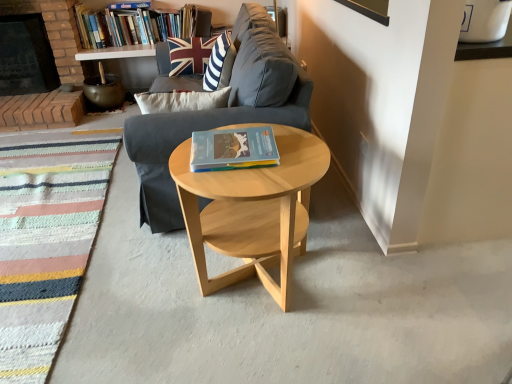
Question: Is union jack fabric pillow at upper center to the left or to the right of striped fabric rug at lower left in the image?

Choices:
 (A) left
 (B) right

Answer: (B)

Question: Considering the positions of point tap(222, 39) and point tap(17, 279), is point tap(222, 39) closer or farther from the camera than point tap(17, 279)?

Choices:
 (A) farther
 (B) closer

Answer: (A)

Question: Which object is the closest to the brick fireplace at left?

Choices:
 (A) hardcover book at center, which is counted as the second book, starting from the top
 (B) natural wood side table at center
 (C) gray fabric couch at center
 (D) striped fabric rug at lower left
 (E) union jack fabric pillow at upper center

Answer: (D)

Question: Which is farther from the natural wood side table at center?

Choices:
 (A) hardcover book at upper center, which is the 2th book in right-to-left order
 (B) hardcover book at center, the second book from the left
 (C) union jack fabric pillow at upper center
 (D) gray fabric couch at center
 (E) striped fabric rug at lower left

Answer: (A)